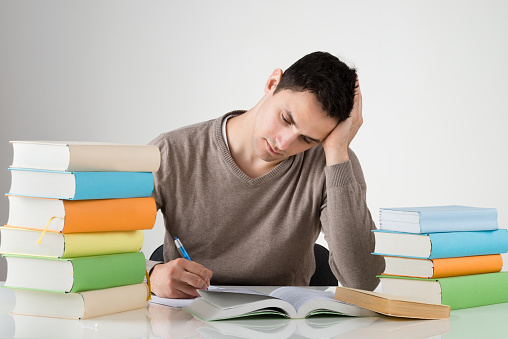
Identify the location of books on right. This screenshot has height=339, width=508. point(424,216), point(422,241), point(424,272), point(424,290), point(415,309).